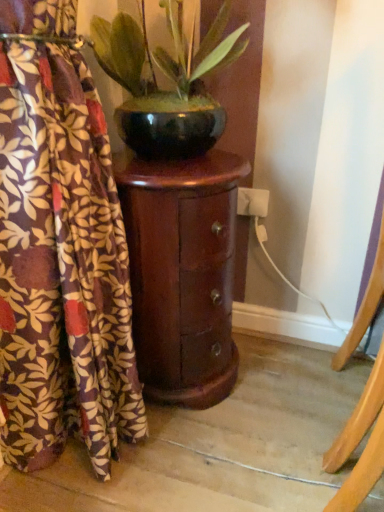
Question: Does brown floral fabric at left have a lesser width compared to shiny dark wood cabinet at center?

Choices:
 (A) yes
 (B) no

Answer: (A)

Question: Can you confirm if brown floral fabric at left is taller than shiny dark wood cabinet at center?

Choices:
 (A) yes
 (B) no

Answer: (A)

Question: Are brown floral fabric at left and shiny dark wood cabinet at center making contact?

Choices:
 (A) yes
 (B) no

Answer: (B)

Question: Can you confirm if brown floral fabric at left is wider than shiny dark wood cabinet at center?

Choices:
 (A) no
 (B) yes

Answer: (A)

Question: From a real-world perspective, is brown floral fabric at left positioned over shiny dark wood cabinet at center based on gravity?

Choices:
 (A) no
 (B) yes

Answer: (B)

Question: Considering the positions of shiny dark wood cabinet at center and shiny black pot at center in the image, is shiny dark wood cabinet at center taller or shorter than shiny black pot at center?

Choices:
 (A) short
 (B) tall

Answer: (B)

Question: In terms of size, does shiny dark wood cabinet at center appear bigger or smaller than shiny black pot at center?

Choices:
 (A) small
 (B) big

Answer: (B)

Question: Is shiny dark wood cabinet at center inside or outside of shiny black pot at center?

Choices:
 (A) outside
 (B) inside

Answer: (A)

Question: Is shiny dark wood cabinet at center to the left or to the right of shiny black pot at center in the image?

Choices:
 (A) right
 (B) left

Answer: (B)

Question: From a real-world perspective, is shiny black pot at center positioned above or below shiny dark wood cabinet at center?

Choices:
 (A) below
 (B) above

Answer: (B)

Question: Does point (96, 25) appear closer or farther from the camera than point (195, 331)?

Choices:
 (A) farther
 (B) closer

Answer: (B)

Question: Considering the positions of shiny black pot at center and shiny dark wood cabinet at center in the image, is shiny black pot at center wider or thinner than shiny dark wood cabinet at center?

Choices:
 (A) wide
 (B) thin

Answer: (A)

Question: Looking at the image, does shiny black pot at center seem bigger or smaller compared to shiny dark wood cabinet at center?

Choices:
 (A) big
 (B) small

Answer: (B)

Question: From a real-world perspective, is shiny dark wood cabinet at center positioned above or below brown floral fabric at left?

Choices:
 (A) above
 (B) below

Answer: (B)

Question: Considering their positions, is shiny dark wood cabinet at center located in front of or behind brown floral fabric at left?

Choices:
 (A) behind
 (B) front

Answer: (A)